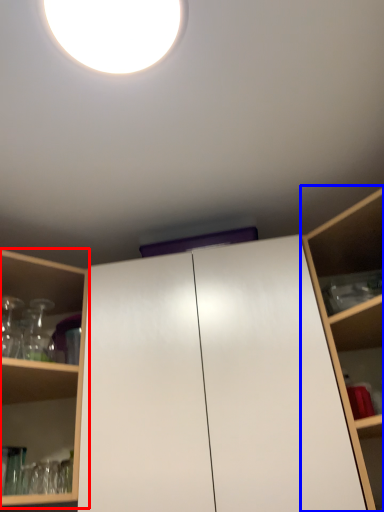
Question: Which object appears farthest to the camera in this image, shelf (highlighted by a red box) or shelf (highlighted by a blue box)?

Choices:
 (A) shelf
 (B) shelf

Answer: (A)